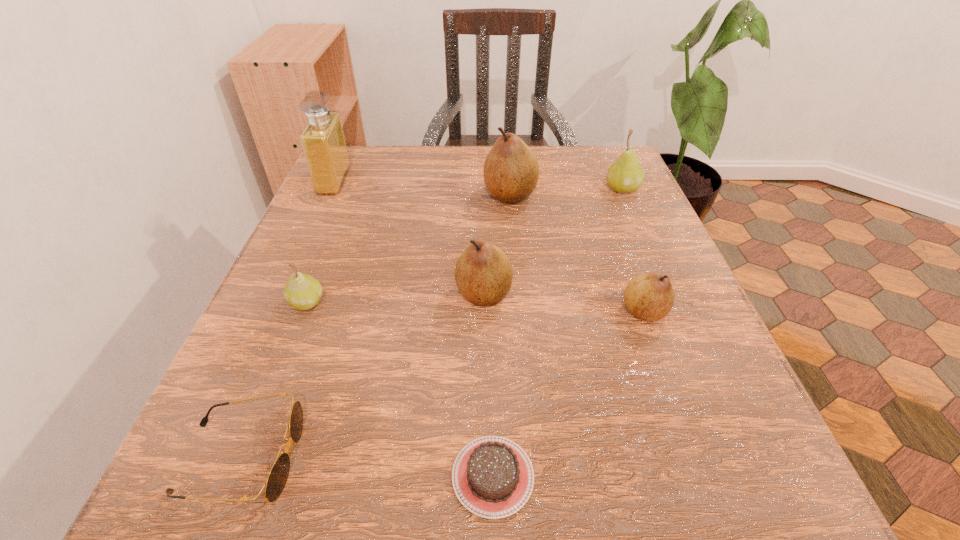
Image resolution: width=960 pixels, height=540 pixels. I want to click on vacant region at the far edge of the desktop, so click(x=532, y=197).

I want to click on vacant space at the near edge of the desktop, so click(x=468, y=520).

You are a GUI agent. You are given a task and a screenshot of the screen. Output one action in this format:
    pyautogui.click(x=<x>, y=<y>)
    Task: Click on the free location at the left edge of the desktop
    Image resolution: width=960 pixels, height=540 pixels.
    Given the screenshot: What is the action you would take?
    pyautogui.click(x=267, y=296)

In the image, there is a desktop. What are the coordinates of `vacant space at the right edge` in the screenshot? It's located at point(649,207).

Where is `vacant area at the far left corner`? vacant area at the far left corner is located at coordinates (395, 160).

In the image, there is a desktop. Where is `vacant space at the near left corner`? vacant space at the near left corner is located at coordinates (217, 467).

In the image, there is a desktop. Where is `free region at the far right corner`? free region at the far right corner is located at coordinates (584, 166).

In the image, there is a desktop. Where is `vacant space at the near right corner`? The height and width of the screenshot is (540, 960). vacant space at the near right corner is located at coordinates (773, 476).

Find the location of `blank region between the nearer green pear and the second tallest object`. blank region between the nearer green pear and the second tallest object is located at coordinates (409, 248).

Locate an element on the screen. The height and width of the screenshot is (540, 960). free space between the perfume and the biggest brown pear is located at coordinates (422, 187).